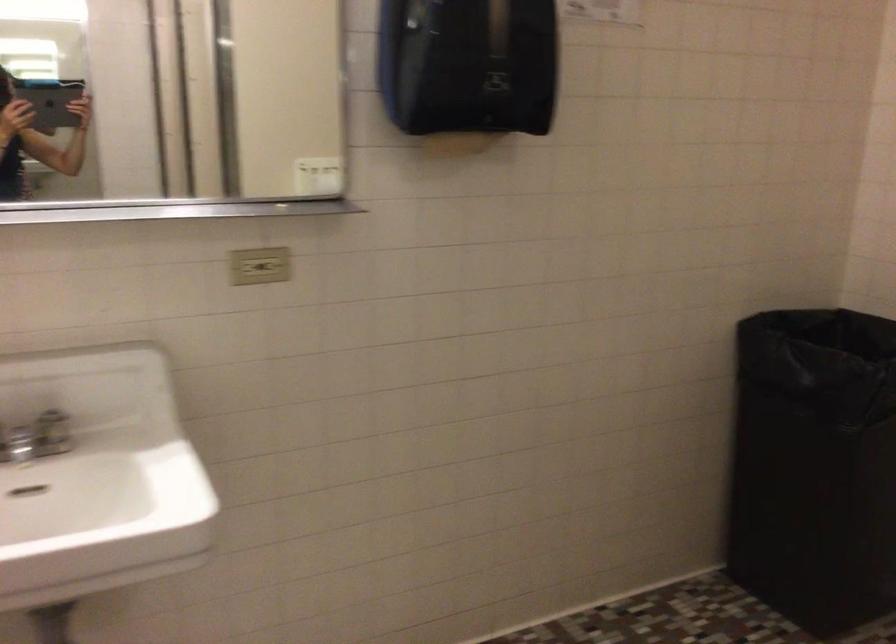
Where would you plac the black trash can? Please return your answer as a coordinate pair (x, y).

(814, 466)